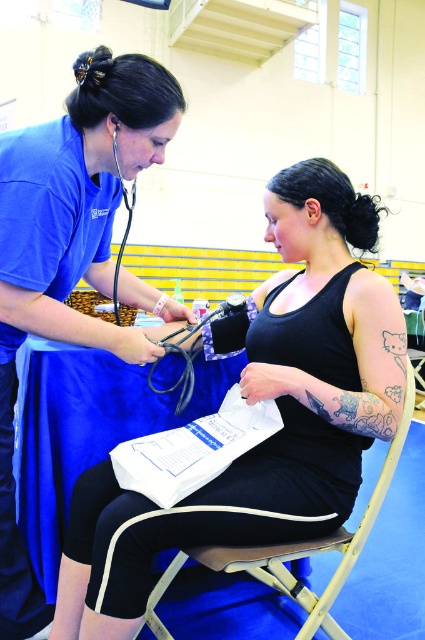
Question: Which of these objects is positioned farthest from the black matte tank top at center?

Choices:
 (A) metallic silver chair at center
 (B) matte blue shirt at upper left
 (C) black rubber stethoscope at center

Answer: (B)

Question: Does metallic silver chair at center appear over black rubber stethoscope at center?

Choices:
 (A) yes
 (B) no

Answer: (B)

Question: Does metallic silver chair at center have a greater width compared to black rubber stethoscope at center?

Choices:
 (A) no
 (B) yes

Answer: (B)

Question: Which of the following is the closest to the observer?

Choices:
 (A) (147, 385)
 (B) (14, 184)
 (C) (187, 556)
 (D) (325, 221)

Answer: (B)

Question: Does metallic silver chair at center appear under black rubber stethoscope at center?

Choices:
 (A) yes
 (B) no

Answer: (A)

Question: Which point appears closest to the camera in this image?

Choices:
 (A) (5, 168)
 (B) (203, 339)
 (C) (235, 557)

Answer: (C)